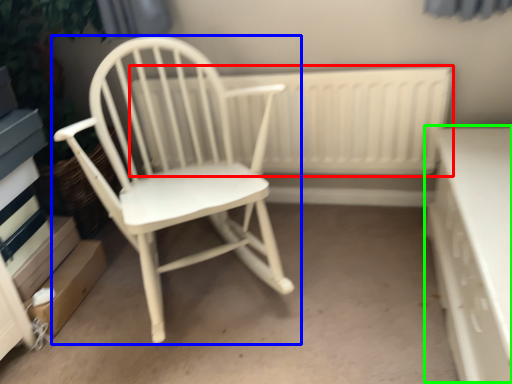
Question: Estimate the real-world distances between objects in this image. Which object is farther from radiator (highlighted by a red box), chair (highlighted by a blue box) or table (highlighted by a green box)?

Choices:
 (A) chair
 (B) table

Answer: (B)